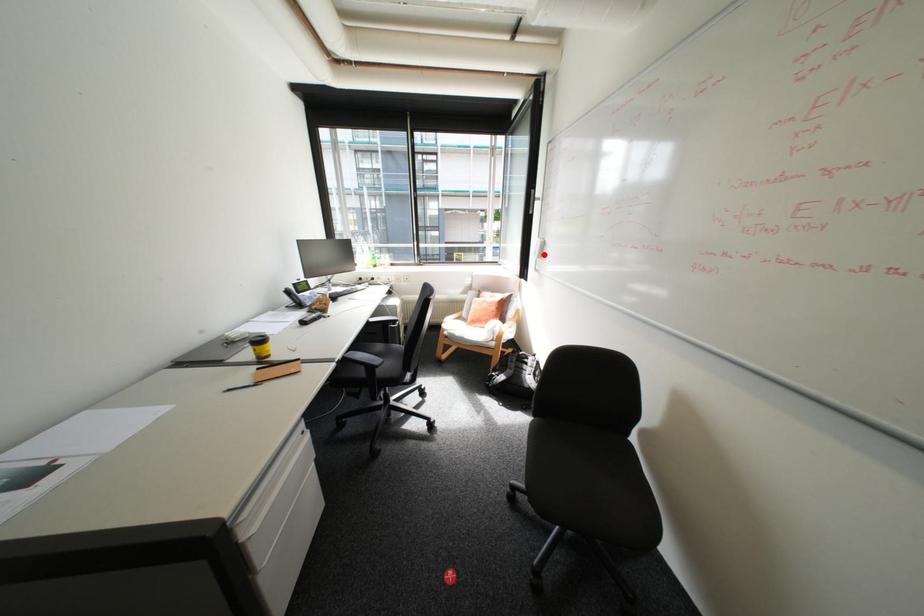
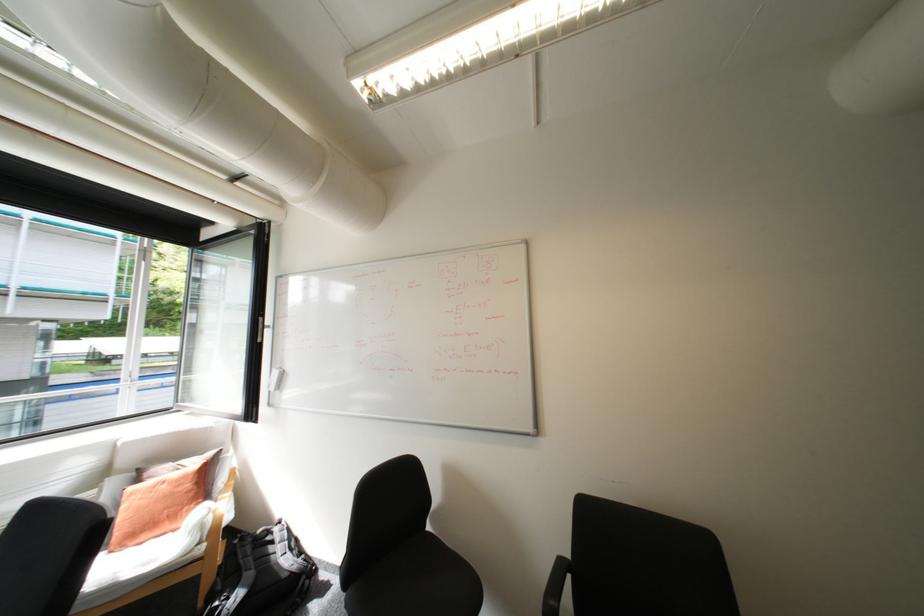
Question: I am providing you with two images of the same scene from different viewpoints. Given a red point in image1, look at the same physical point in image2. Is it:

Choices:
 (A) Closer to the viewpoint
 (B) Farther from the viewpoint

Answer: (B)